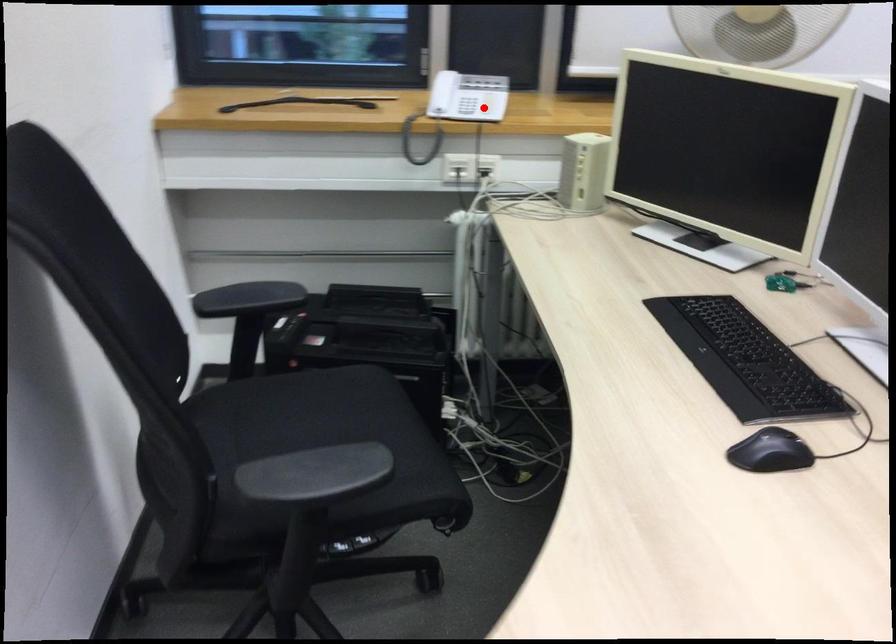
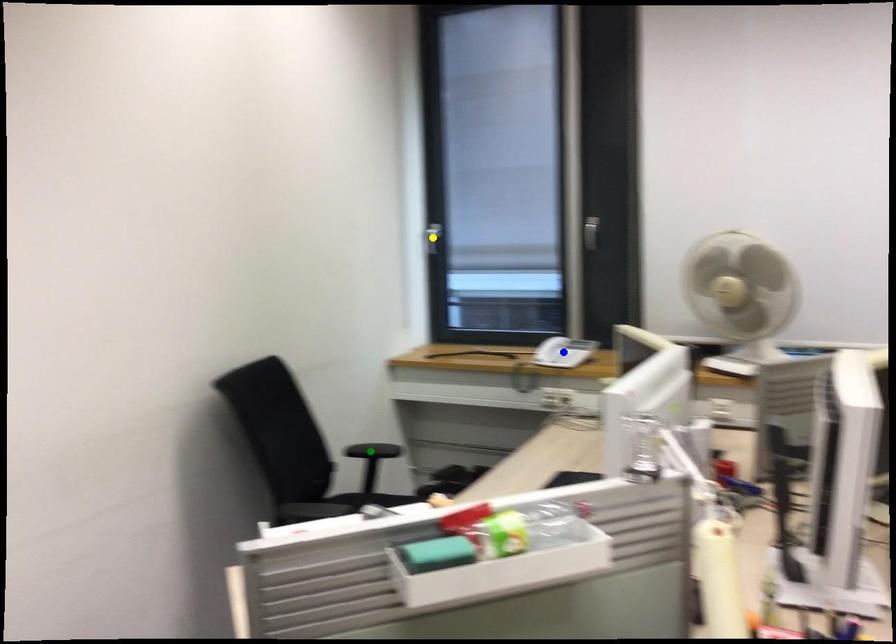
Question: I am providing you with two images of the same scene from different viewpoints. A red point is marked on the first image. You are given multiple points on the second image. Which point in image 2 represents the same 3d spot as the red point in image 1?

Choices:
 (A) green point
 (B) blue point
 (C) yellow point

Answer: (B)